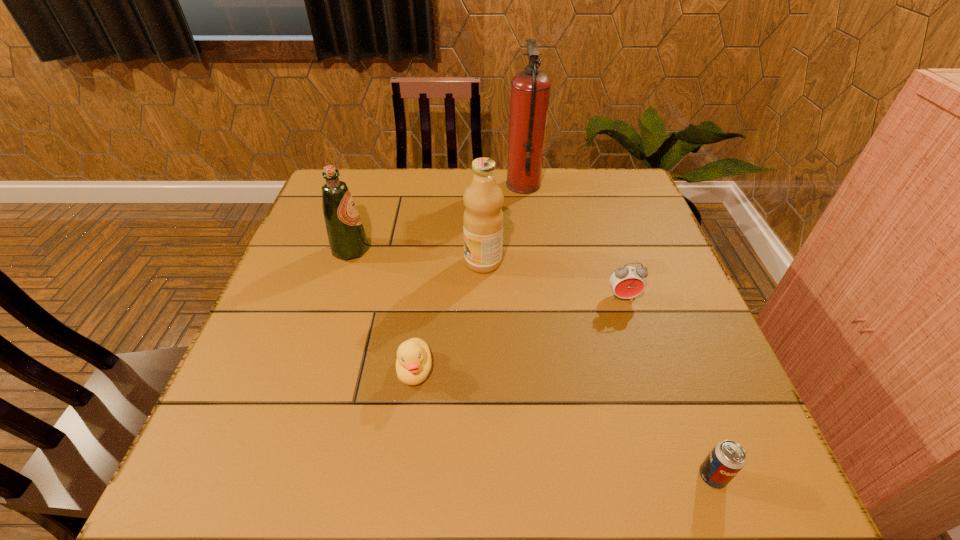
Where is `free space located at the nozzle of the farthest object`? Image resolution: width=960 pixels, height=540 pixels. free space located at the nozzle of the farthest object is located at coordinates (x=487, y=185).

Locate an element on the screen. vacant area situated at the nozzle of the farthest object is located at coordinates (393, 185).

You are a GUI agent. You are given a task and a screenshot of the screen. Output one action in this format:
    pyautogui.click(x=<x>, y=<y>)
    Task: Click on the free space located 0.100m at the nozzle of the farthest object
    
    Given the screenshot: What is the action you would take?
    pyautogui.click(x=474, y=185)

I want to click on blank space located 0.400m on the label of the right olive oil, so click(305, 262).

This screenshot has width=960, height=540. What are the coordinates of `blank space located 0.240m on the label of the right olive oil` in the screenshot? It's located at (369, 262).

Locate an element on the screen. The image size is (960, 540). free space located on the label of the right olive oil is located at coordinates (380, 262).

Identify the location of free space located 0.310m on the front-facing side of the shorter olive oil. (490, 250).

Find the location of a particular element. This screenshot has width=960, height=540. free space located 0.340m on the face of the fourth tallest object is located at coordinates (671, 449).

I want to click on free region located on the face of the duckling, so click(x=400, y=484).

This screenshot has height=540, width=960. I want to click on free space located 0.120m on the left of the beer can, so click(x=626, y=476).